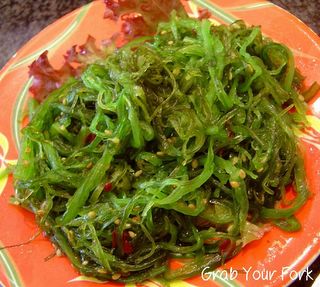
What are the coordinates of `corner` in the screenshot? It's located at (308, 9).